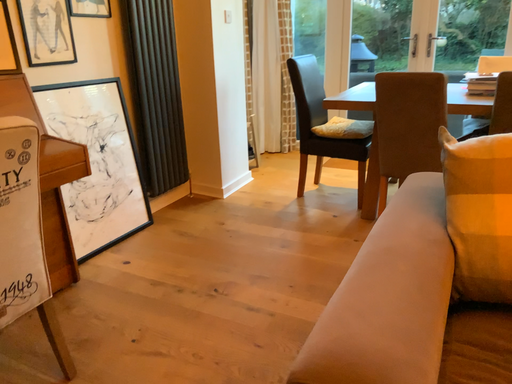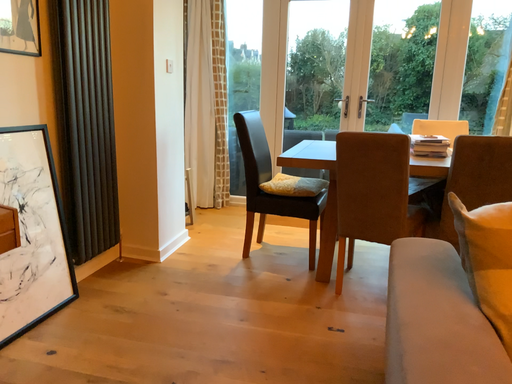
Question: Which way did the camera rotate in the video?

Choices:
 (A) rotated downward
 (B) rotated upward

Answer: (B)